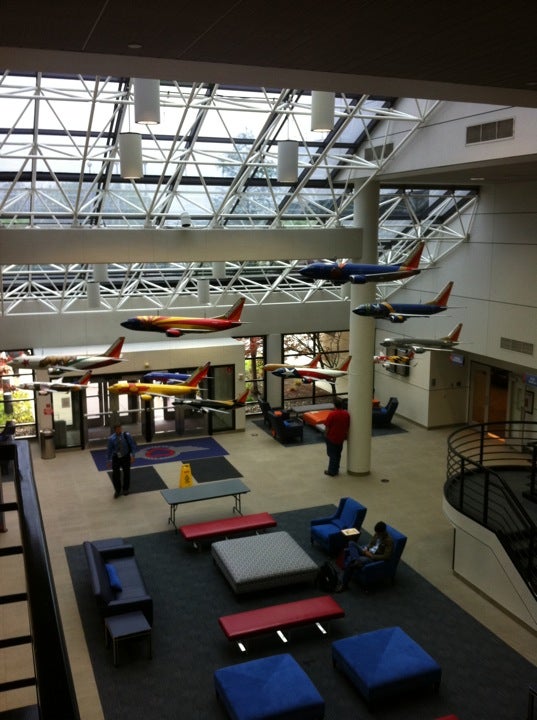
Locate an element on the screen. The width and height of the screenshot is (537, 720). window is located at coordinates (249, 348), (300, 345), (329, 343), (330, 359), (297, 387), (323, 390), (13, 410), (252, 368).